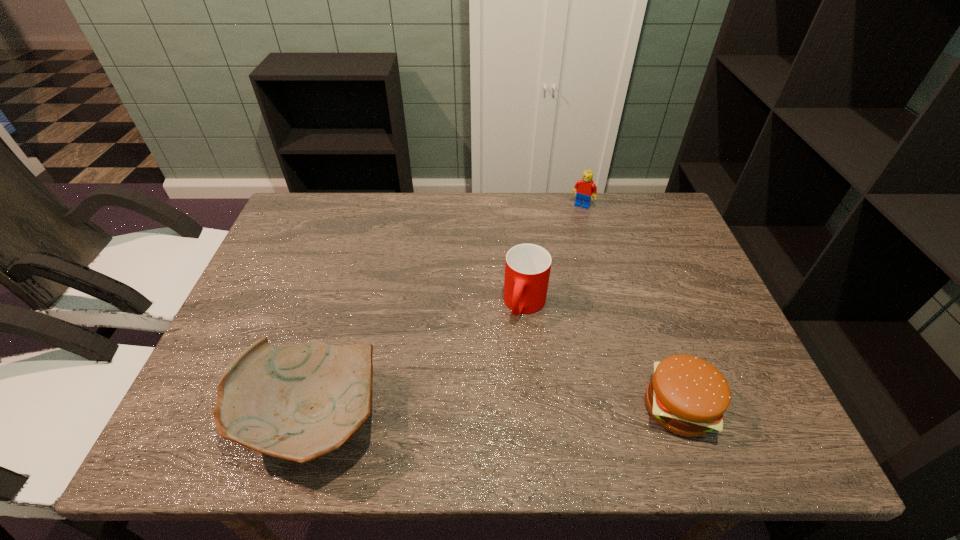
Locate an element on the screen. This screenshot has width=960, height=540. free space at the far edge of the desktop is located at coordinates (529, 221).

Identify the location of free region at the near edge of the desktop. The height and width of the screenshot is (540, 960). (516, 387).

The width and height of the screenshot is (960, 540). Find the location of `free location at the left edge of the desktop`. free location at the left edge of the desktop is located at coordinates (274, 254).

Identify the location of free space at the right edge. The height and width of the screenshot is (540, 960). (710, 333).

In the image, there is a desktop. At what (x,y) coordinates should I click in order to perform the action: click on vacant space at the far left corner. Please return your answer as a coordinate pair (x, y). Looking at the image, I should click on (311, 226).

In the image, there is a desktop. Where is `vacant space at the far right corner`? The height and width of the screenshot is (540, 960). vacant space at the far right corner is located at coordinates (639, 228).

Identify the location of free spot between the hamburger and the second farthest object. (602, 355).

Locate an element on the screen. Image resolution: width=960 pixels, height=540 pixels. vacant area that lies between the pottery and the second farthest object is located at coordinates (419, 361).

This screenshot has height=540, width=960. In order to click on free spot between the Lego and the shortest object in this screenshot , I will do `click(631, 306)`.

Where is `free space between the pottery and the hamburger`? free space between the pottery and the hamburger is located at coordinates (495, 413).